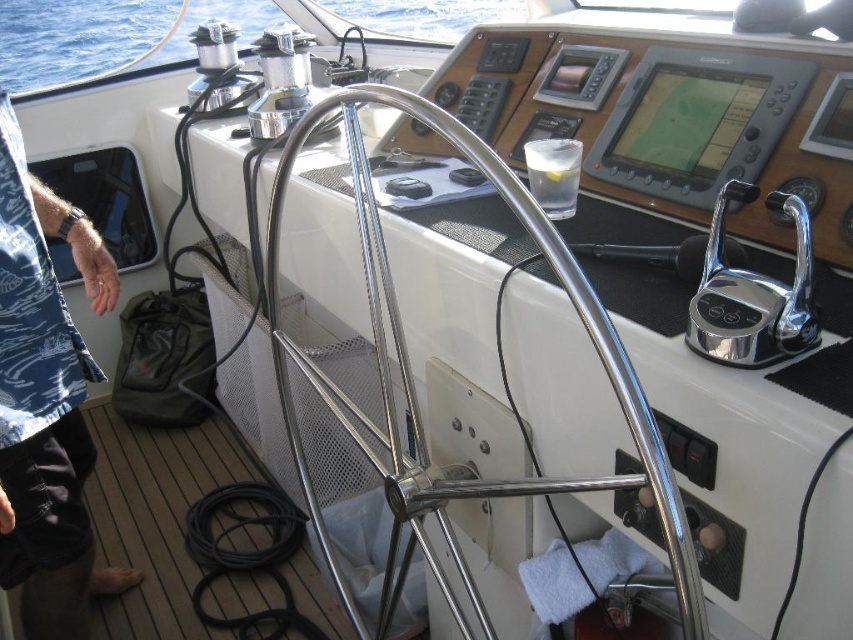
Does point (42, 579) come in front of point (4, 58)?

That is True.

Does blue printed fabric at left have a greater height compared to blue water at upper left?

Yes.

Find the location of a particular element. This screenshot has height=640, width=853. blue printed fabric at left is located at coordinates (45, 403).